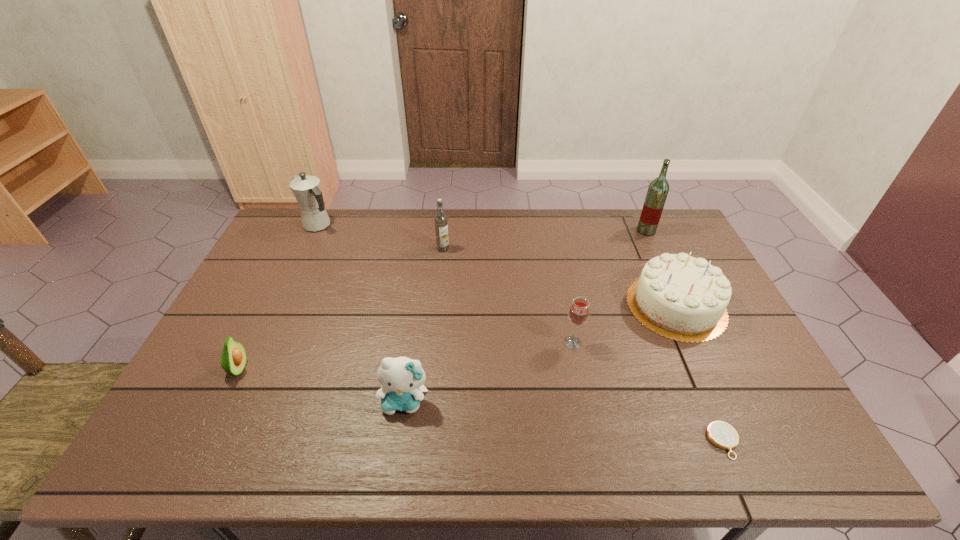
Where is `vacant space situated 0.400m on the front of the liquor`? vacant space situated 0.400m on the front of the liquor is located at coordinates (687, 319).

This screenshot has height=540, width=960. What are the coordinates of `vacant space situated 0.360m on the right of the coffeepot` in the screenshot? It's located at (433, 226).

Find the location of `vacant point located on the label of the third farthest object`. vacant point located on the label of the third farthest object is located at coordinates (441, 270).

Locate an element on the screen. The width and height of the screenshot is (960, 540). free space located on the front of the birthday cake is located at coordinates (716, 393).

Locate an element on the screen. Image resolution: width=960 pixels, height=540 pixels. vacant area located on the back of the wineglass is located at coordinates (564, 301).

Identify the location of free point located 0.080m on the face of the second nearest object. Image resolution: width=960 pixels, height=540 pixels. click(397, 451).

You are a GUI agent. You are given a task and a screenshot of the screen. Output one action in this format:
    pyautogui.click(x=<x>, y=<y>)
    Task: Click on the free space located 0.220m on the cut side of the third nearest object
    
    Given the screenshot: What is the action you would take?
    pyautogui.click(x=332, y=370)

The height and width of the screenshot is (540, 960). What are the coordinates of `vacant position located 0.130m on the back of the nearest object` in the screenshot? It's located at (696, 377).

You are a GUI agent. You are given a task and a screenshot of the screen. Output one action in this format:
    pyautogui.click(x=<x>, y=<y>)
    Task: Click on the liquor that is at the far edge
    This screenshot has height=540, width=960.
    Given the screenshot: What is the action you would take?
    pyautogui.click(x=658, y=189)

Identify the location of coffeepot at the far edge. (306, 189).